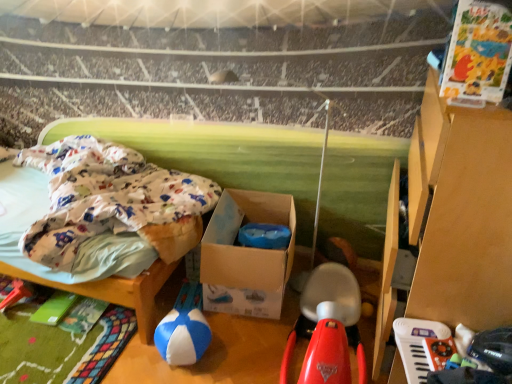
Question: Does white plastic keyboard at lower right, placed as the first toy when sorted from right to left, lie behind blue/white fabric ball at center, the 1th toy viewed from the left?

Choices:
 (A) no
 (B) yes

Answer: (A)

Question: Does white plastic keyboard at lower right, placed as the first toy when sorted from right to left, have a greater width compared to blue/white fabric ball at center, positioned as the 3th toy in right-to-left order?

Choices:
 (A) yes
 (B) no

Answer: (B)

Question: From the image's perspective, does white plastic keyboard at lower right, placed as the first toy when sorted from right to left, appear higher than blue/white fabric ball at center, positioned as the 3th toy in right-to-left order?

Choices:
 (A) yes
 (B) no

Answer: (A)

Question: Considering the relative sizes of white plastic keyboard at lower right, acting as the 3th toy starting from the left, and blue/white fabric ball at center, positioned as the 3th toy in right-to-left order, in the image provided, is white plastic keyboard at lower right, acting as the 3th toy starting from the left, taller than blue/white fabric ball at center, positioned as the 3th toy in right-to-left order,?

Choices:
 (A) yes
 (B) no

Answer: (B)

Question: From the image's perspective, would you say white plastic keyboard at lower right, acting as the 3th toy starting from the left, is shown under blue/white fabric ball at center, positioned as the 3th toy in right-to-left order?

Choices:
 (A) yes
 (B) no

Answer: (B)

Question: Is white plastic keyboard at lower right, acting as the 3th toy starting from the left, bigger than blue/white fabric ball at center, the 1th toy viewed from the left?

Choices:
 (A) no
 (B) yes

Answer: (A)

Question: Does cardboard box at center appear on the right side of rubberized red scooter at center, the 2th toy when ordered from left to right?

Choices:
 (A) no
 (B) yes

Answer: (A)

Question: Is cardboard box at center taller than rubberized red scooter at center, the 2th toy when ordered from left to right?

Choices:
 (A) no
 (B) yes

Answer: (B)

Question: Are cardboard box at center and rubberized red scooter at center, marked as the 2th toy in a right-to-left arrangement, beside each other?

Choices:
 (A) no
 (B) yes

Answer: (A)

Question: Does cardboard box at center lie behind rubberized red scooter at center, marked as the 2th toy in a right-to-left arrangement?

Choices:
 (A) yes
 (B) no

Answer: (A)

Question: From a real-world perspective, is cardboard box at center below rubberized red scooter at center, marked as the 2th toy in a right-to-left arrangement?

Choices:
 (A) no
 (B) yes

Answer: (A)

Question: Is cardboard box at center wider than rubberized red scooter at center, the 2th toy when ordered from left to right?

Choices:
 (A) yes
 (B) no

Answer: (B)

Question: Is blue/white fabric ball at center, positioned as the 3th toy in right-to-left order, next to white plastic keyboard at lower right, acting as the 3th toy starting from the left?

Choices:
 (A) no
 (B) yes

Answer: (A)